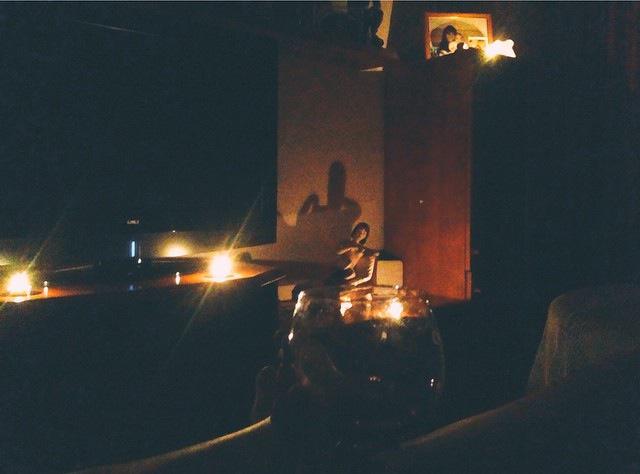
Find the location of `flat screen tv`. flat screen tv is located at coordinates (140, 117).